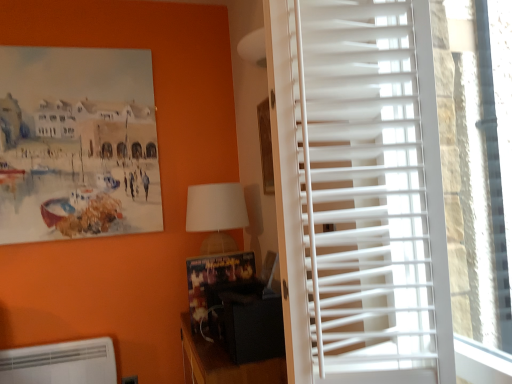
Question: Does white plastic air conditioning unit at lower left come in front of black matte speaker at lower center?

Choices:
 (A) yes
 (B) no

Answer: (B)

Question: Is white plastic air conditioning unit at lower left next to black matte speaker at lower center and touching it?

Choices:
 (A) no
 (B) yes

Answer: (A)

Question: From the image's perspective, is white plastic air conditioning unit at lower left beneath black matte speaker at lower center?

Choices:
 (A) no
 (B) yes

Answer: (B)

Question: Is white plastic air conditioning unit at lower left smaller than black matte speaker at lower center?

Choices:
 (A) yes
 (B) no

Answer: (A)

Question: Is white plastic air conditioning unit at lower left wider than black matte speaker at lower center?

Choices:
 (A) no
 (B) yes

Answer: (A)

Question: From a real-world perspective, is white plastic air conditioning unit at lower left on top of black matte speaker at lower center?

Choices:
 (A) no
 (B) yes

Answer: (A)

Question: Is wooden bulletin board at center not close to black matte speaker at lower center?

Choices:
 (A) yes
 (B) no

Answer: (B)

Question: Is wooden bulletin board at center at the left side of black matte speaker at lower center?

Choices:
 (A) yes
 (B) no

Answer: (A)

Question: From the image's perspective, is wooden bulletin board at center located beneath black matte speaker at lower center?

Choices:
 (A) yes
 (B) no

Answer: (B)

Question: Is wooden bulletin board at center outside of black matte speaker at lower center?

Choices:
 (A) no
 (B) yes

Answer: (B)

Question: From a real-world perspective, is wooden bulletin board at center positioned under black matte speaker at lower center based on gravity?

Choices:
 (A) no
 (B) yes

Answer: (A)

Question: Is wooden bulletin board at center wider than black matte speaker at lower center?

Choices:
 (A) no
 (B) yes

Answer: (A)

Question: Is black matte speaker at lower center next to white plastic blinds at right and touching it?

Choices:
 (A) yes
 (B) no

Answer: (B)